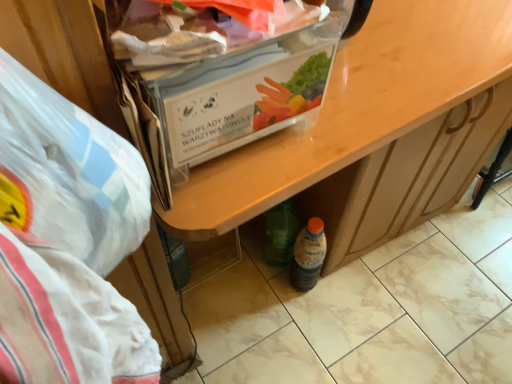
Question: Is white plastic bag at left positioned with its back to clear plastic box at upper center?

Choices:
 (A) no
 (B) yes

Answer: (A)

Question: Are white plastic bag at left and clear plastic box at upper center beside each other?

Choices:
 (A) no
 (B) yes

Answer: (A)

Question: Is white plastic bag at left taller than clear plastic box at upper center?

Choices:
 (A) yes
 (B) no

Answer: (A)

Question: From the image's perspective, does white plastic bag at left appear higher than clear plastic box at upper center?

Choices:
 (A) yes
 (B) no

Answer: (B)

Question: Can you confirm if white plastic bag at left is positioned to the left of clear plastic box at upper center?

Choices:
 (A) yes
 (B) no

Answer: (B)

Question: Can you confirm if white plastic bag at left is shorter than clear plastic box at upper center?

Choices:
 (A) yes
 (B) no

Answer: (B)

Question: Can you confirm if white plastic bag at left is positioned to the left of wooden desk at center?

Choices:
 (A) yes
 (B) no

Answer: (A)

Question: Does white plastic bag at left have a lesser height compared to wooden desk at center?

Choices:
 (A) no
 (B) yes

Answer: (B)

Question: From a real-world perspective, does white plastic bag at left stand above wooden desk at center?

Choices:
 (A) yes
 (B) no

Answer: (A)

Question: Does white plastic bag at left have a greater width compared to wooden desk at center?

Choices:
 (A) yes
 (B) no

Answer: (B)

Question: Is white plastic bag at left bigger than wooden desk at center?

Choices:
 (A) no
 (B) yes

Answer: (A)

Question: Is white plastic bag at left outside wooden desk at center?

Choices:
 (A) yes
 (B) no

Answer: (A)

Question: Can you confirm if clear plastic box at upper center is positioned to the right of white plastic bag at left?

Choices:
 (A) no
 (B) yes

Answer: (A)